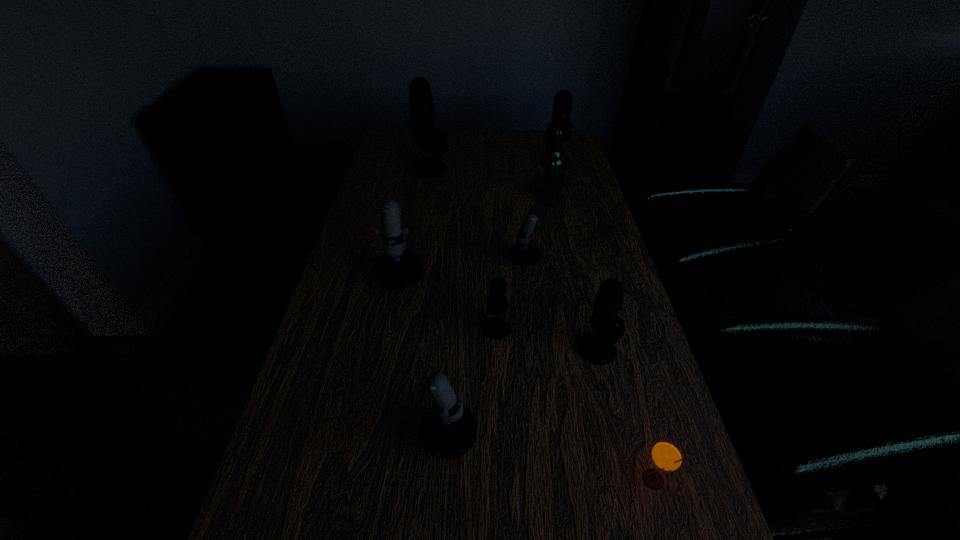
Point out which white microphone is positioned as the nearest to the third farthest object. Please provide its 2D coordinates. Your answer should be formatted as a tuple, i.e. [(x, y)], where the tuple contains the x and y coordinates of a point satisfying the conditions above.

[(523, 253)]

Choose which white microphone is the nearest neighbor to the third smallest black microphone. Please provide its 2D coordinates. Your answer should be formatted as a tuple, i.e. [(x, y)], where the tuple contains the x and y coordinates of a point satisfying the conditions above.

[(523, 253)]

Where is `free location that satisfies the following two spatial constraints: 1. on the front side of the third biggest black microphone; 2. on the right side of the sixth object from right to left`? This screenshot has height=540, width=960. free location that satisfies the following two spatial constraints: 1. on the front side of the third biggest black microphone; 2. on the right side of the sixth object from right to left is located at coordinates point(497,349).

Find the location of a particular element. blank area in the image that satisfies the following two spatial constraints: 1. on the front side of the nearest white microphone; 2. on the left side of the tallest object is located at coordinates (384, 438).

The image size is (960, 540). Identify the location of free spot that satisfies the following two spatial constraints: 1. on the front side of the sixth object from right to left; 2. on the left side of the straw. (501, 480).